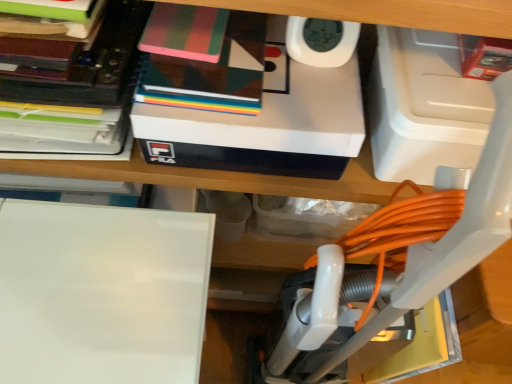
Question: Is white matte box at upper center taller than white glossy board at lower left?

Choices:
 (A) yes
 (B) no

Answer: (B)

Question: Is the position of white matte box at upper center less distant than that of white glossy board at lower left?

Choices:
 (A) no
 (B) yes

Answer: (A)

Question: Is white matte box at upper center not close to white glossy board at lower left?

Choices:
 (A) no
 (B) yes

Answer: (A)

Question: Can you confirm if white matte box at upper center is positioned to the left of white glossy board at lower left?

Choices:
 (A) yes
 (B) no

Answer: (B)

Question: Is white matte box at upper center touching white glossy board at lower left?

Choices:
 (A) no
 (B) yes

Answer: (A)

Question: From a real-world perspective, relative to matte black book at upper left, which ranks as the first book in left-to-right order, is white glossy board at lower left vertically above or below?

Choices:
 (A) below
 (B) above

Answer: (A)

Question: Is point (31, 291) positioned closer to the camera than point (146, 1)?

Choices:
 (A) closer
 (B) farther

Answer: (A)

Question: From the image's perspective, relative to matte black book at upper left, which is the second book in right-to-left order, is white glossy board at lower left above or below?

Choices:
 (A) above
 (B) below

Answer: (B)

Question: Is white glossy board at lower left taller or shorter than matte black book at upper left, which is the second book in right-to-left order?

Choices:
 (A) tall
 (B) short

Answer: (A)

Question: Is multicolored paper at upper center to the left or to the right of white glossy board at lower left in the image?

Choices:
 (A) right
 (B) left

Answer: (A)

Question: Considering the positions of multicolored paper at upper center and white glossy board at lower left in the image, is multicolored paper at upper center wider or thinner than white glossy board at lower left?

Choices:
 (A) wide
 (B) thin

Answer: (B)

Question: From a real-world perspective, relative to white glossy board at lower left, is multicolored paper at upper center vertically above or below?

Choices:
 (A) below
 (B) above

Answer: (B)

Question: Considering their positions, is multicolored paper at upper center located in front of or behind white glossy board at lower left?

Choices:
 (A) behind
 (B) front

Answer: (A)

Question: Considering the positions of white matte box at upper center and white plastic vacuum at center in the image, is white matte box at upper center taller or shorter than white plastic vacuum at center?

Choices:
 (A) short
 (B) tall

Answer: (A)

Question: Relative to white plastic vacuum at center, is white matte box at upper center in front or behind?

Choices:
 (A) behind
 (B) front

Answer: (A)